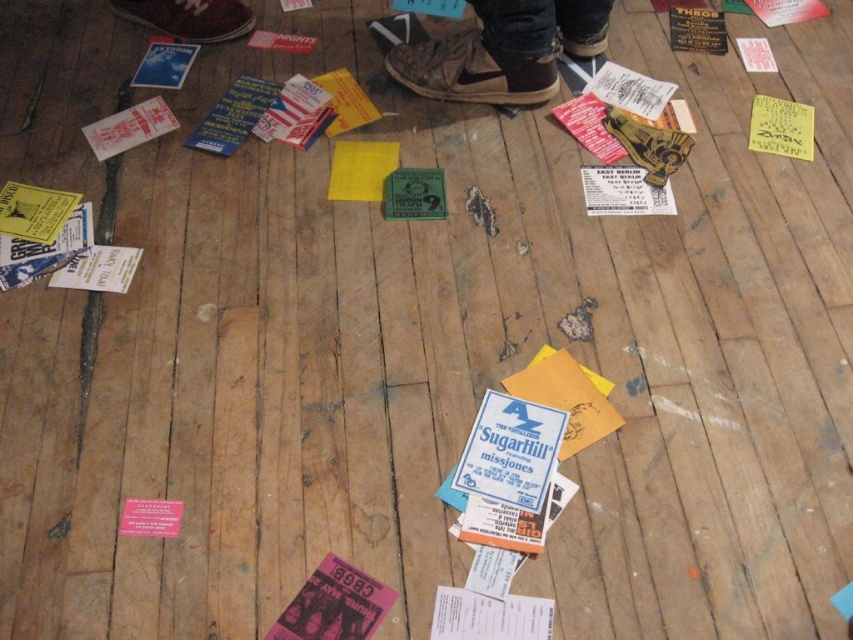
Consider the image. Is yellow paper at upper right bigger than white paper at left?

Indeed, yellow paper at upper right has a larger size compared to white paper at left.

Is yellow paper at upper right in front of white paper at left?

No, it is not.

Which is in front, point (809, 115) or point (73, 272)?

Point (73, 272) is more forward.

Image resolution: width=853 pixels, height=640 pixels. Find the location of `yellow paper at upper right`. yellow paper at upper right is located at coordinates (781, 128).

Can you confirm if yellow paper at upper right is positioned below white paper at upper left?

Indeed, yellow paper at upper right is positioned under white paper at upper left.

Is point (804, 156) in front of point (123, 131)?

Yes, point (804, 156) is in front of point (123, 131).

The width and height of the screenshot is (853, 640). Find the location of `yellow paper at upper right`. yellow paper at upper right is located at coordinates (781, 128).

Who is more forward, (531, 16) or (119, 269)?

Point (119, 269) is more forward.

Can you confirm if brown suede shoes at upper center is bigger than white paper at left?

Yes, brown suede shoes at upper center is bigger than white paper at left.

Where is `brown suede shoes at upper center`? The height and width of the screenshot is (640, 853). brown suede shoes at upper center is located at coordinates (503, 51).

Identify the location of brown suede shoes at upper center. Image resolution: width=853 pixels, height=640 pixels. (503, 51).